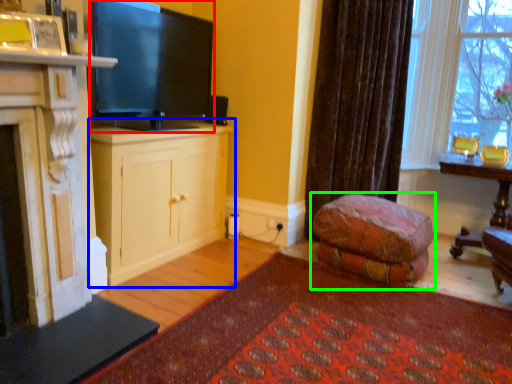
Question: Considering the real-world distances, which object is farthest from television (highlighted by a red box)? cabinetry (highlighted by a blue box) or studio couch (highlighted by a green box)?

Choices:
 (A) cabinetry
 (B) studio couch

Answer: (B)